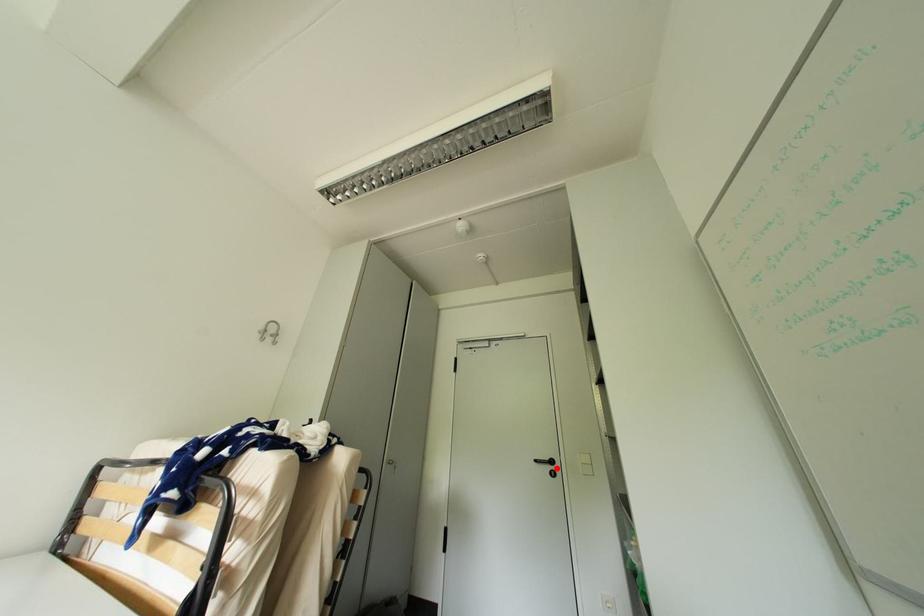
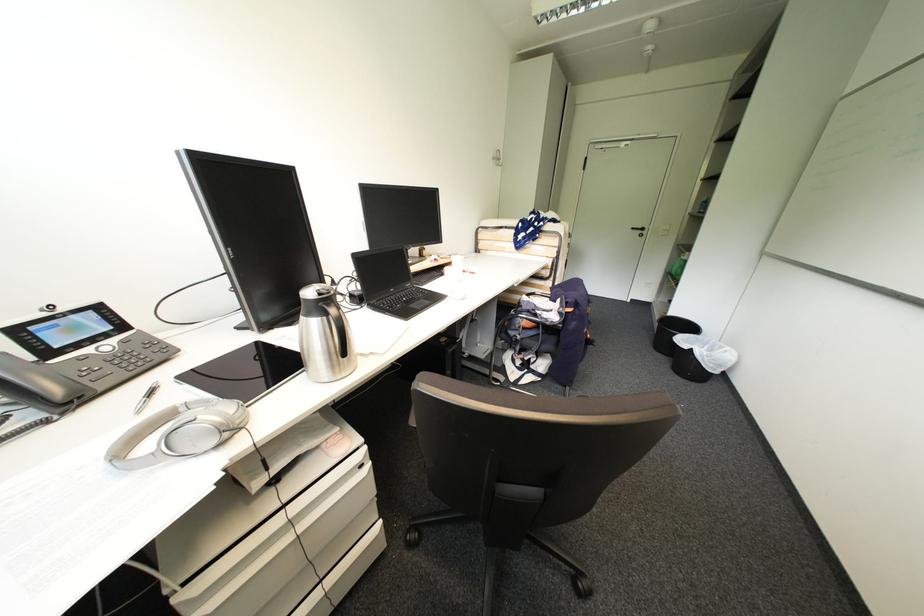
In the second image, find the point that corresponds to the highlighted location in the first image.

(648, 233)